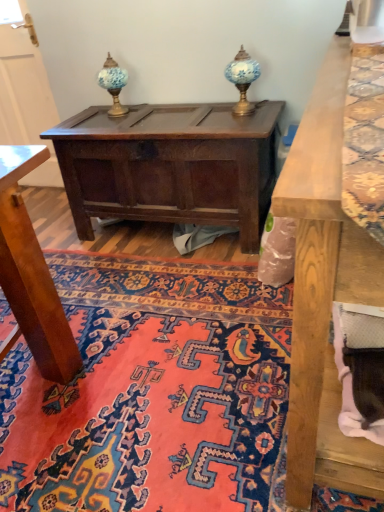
Identify the location of vacant area to the left of blue glass table lamp at upper center, the second table lamp from the left. pos(218,112).